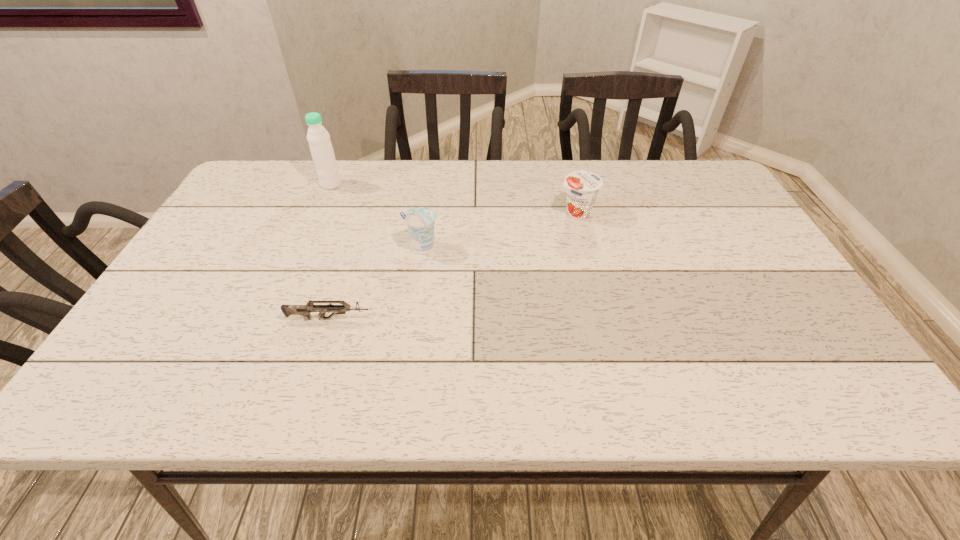
At what (x,y) coordinates should I click in order to perform the action: click on free space that satisfies the following two spatial constraints: 1. on the front side of the farthest object; 2. on the left side of the left yogurt. Please return your answer as a coordinate pair (x, y). Looking at the image, I should click on (304, 247).

Find the location of a particular element. vacant space that satisfies the following two spatial constraints: 1. on the back side of the third farthest object; 2. on the left side of the rightmost object is located at coordinates (426, 213).

Find the location of a particular element. The image size is (960, 540). vacant point that satisfies the following two spatial constraints: 1. on the back side of the nearer yogurt; 2. on the left side of the second farthest object is located at coordinates (426, 213).